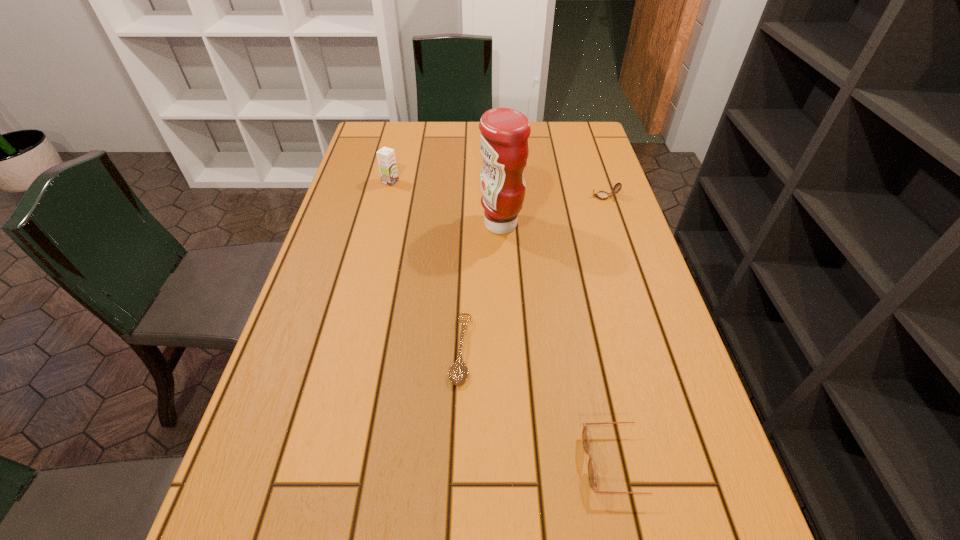
I want to click on the third object from left to right, so click(x=504, y=146).

This screenshot has width=960, height=540. What are the coordinates of `condiment` in the screenshot? It's located at (504, 146).

Where is `the farthest object`? The width and height of the screenshot is (960, 540). the farthest object is located at coordinates (386, 157).

Image resolution: width=960 pixels, height=540 pixels. Identify the location of the fourth shortest object. (386, 157).

The image size is (960, 540). I want to click on the rightmost object, so click(602, 195).

This screenshot has height=540, width=960. In order to click on compass in this screenshot , I will do `click(602, 195)`.

Find the location of a particular element. This screenshot has width=960, height=540. the nearest object is located at coordinates pyautogui.click(x=585, y=436).

Locate an element on the screen. This screenshot has height=540, width=960. the second object from right to left is located at coordinates (585, 436).

Where is `the shortest object`? This screenshot has height=540, width=960. the shortest object is located at coordinates (458, 372).

The height and width of the screenshot is (540, 960). I want to click on ladle, so coord(458,372).